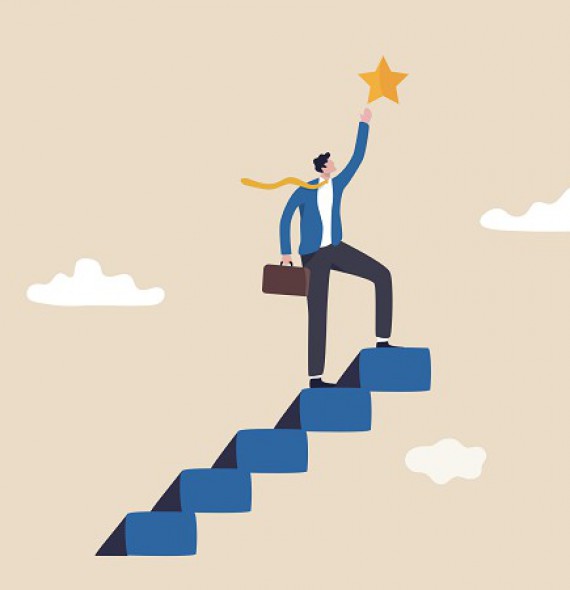
At what (x,y) coordinates should I click in order to perform the action: click on blue stair steps. Please return your answer as a coordinate pair (x, y). This screenshot has height=590, width=570. Looking at the image, I should click on (174, 527), (225, 485), (276, 455), (339, 414), (392, 368).